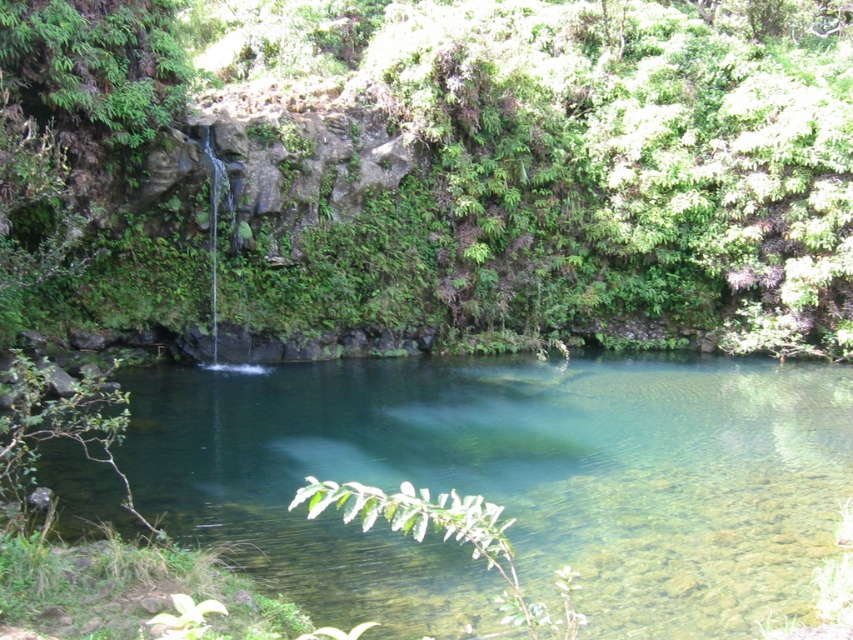
Who is positioned more to the left, green leafy vegetation at upper center or clear glass lake at center?

clear glass lake at center is more to the left.

What do you see at coordinates (440, 168) in the screenshot? I see `green leafy vegetation at upper center` at bounding box center [440, 168].

I want to click on green leafy vegetation at upper center, so click(440, 168).